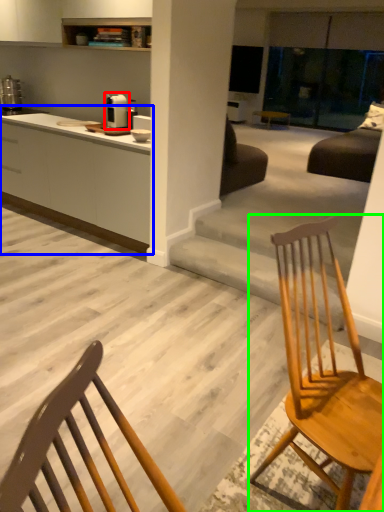
Question: Which object is positioned farthest from appliance (highlighted by a red box)? Select from cabinetry (highlighted by a blue box) and chair (highlighted by a green box).

Choices:
 (A) cabinetry
 (B) chair

Answer: (B)